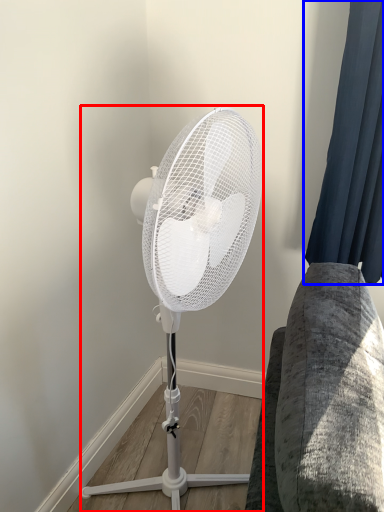
Question: Which object appears farthest to the camera in this image, mechanical fan (highlighted by a red box) or curtain (highlighted by a blue box)?

Choices:
 (A) mechanical fan
 (B) curtain

Answer: (B)